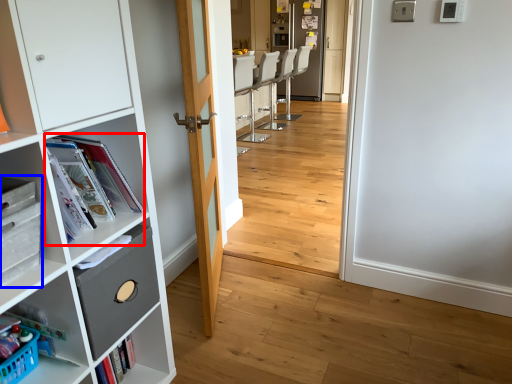
Question: Among these objects, which one is farthest to the camera, magazine (highlighted by a red box) or cabinetry (highlighted by a blue box)?

Choices:
 (A) magazine
 (B) cabinetry

Answer: (A)